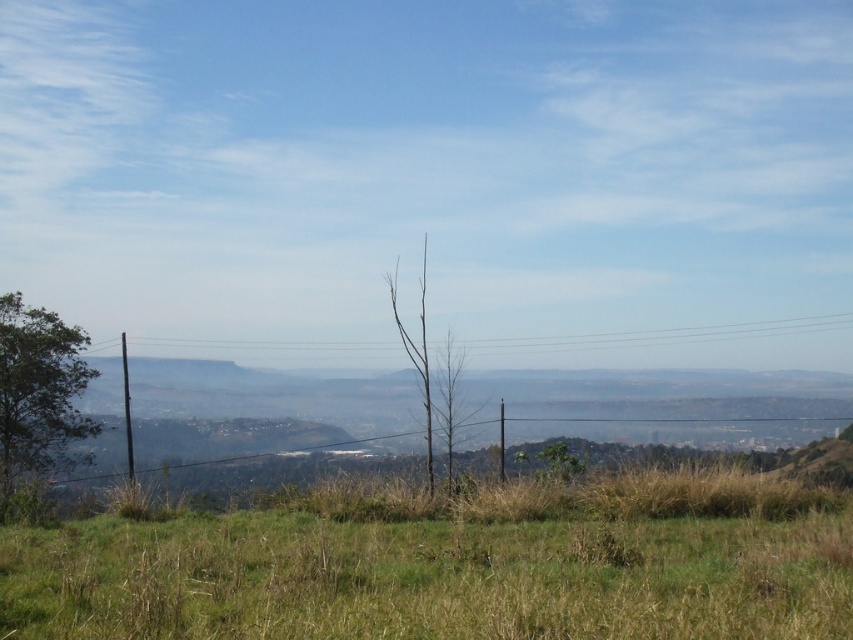
Question: Can you confirm if green grass at lower center is positioned to the left of bare wood tree at center?

Choices:
 (A) no
 (B) yes

Answer: (A)

Question: In this image, where is green leafy tree at left located relative to bare wood tree at center?

Choices:
 (A) below
 (B) above

Answer: (A)

Question: Which point is closer to the camera taking this photo?

Choices:
 (A) (80, 392)
 (B) (334, 563)
 (C) (424, 250)

Answer: (B)

Question: Which point is closer to the camera?

Choices:
 (A) green leafy tree at left
 (B) bare wood tree at center
 (C) green grass at lower center

Answer: (C)

Question: Which point is farther to the camera?

Choices:
 (A) bare wood tree at center
 (B) green leafy tree at left

Answer: (A)

Question: Can you confirm if green grass at lower center is positioned to the left of green leafy tree at left?

Choices:
 (A) no
 (B) yes

Answer: (A)